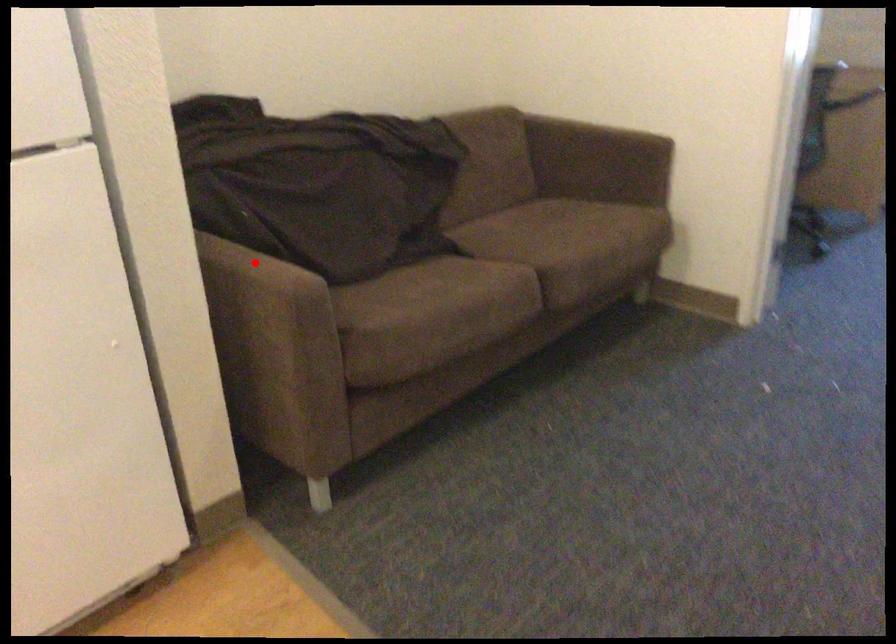
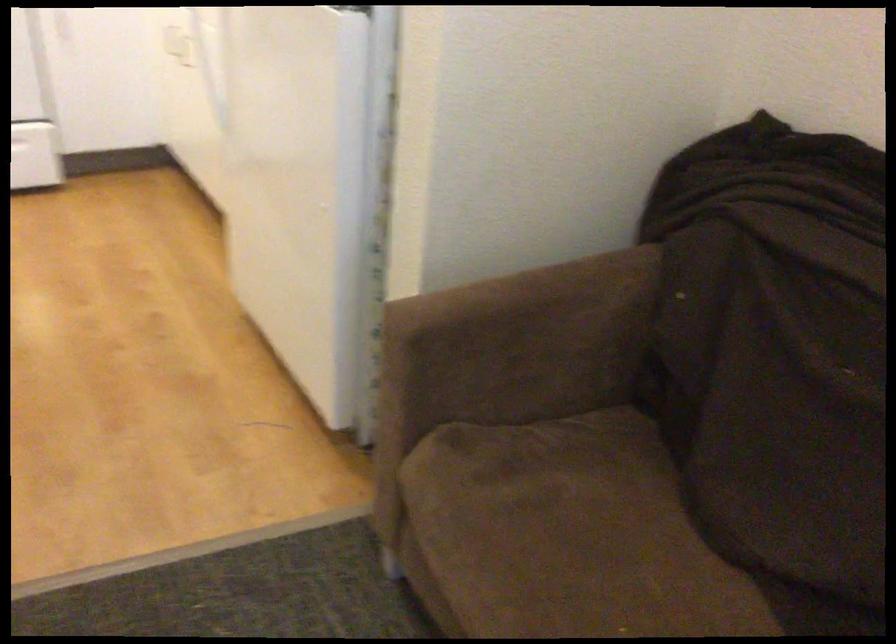
Find the pixel in the second image that matches the highlighted location in the first image.

(533, 310)